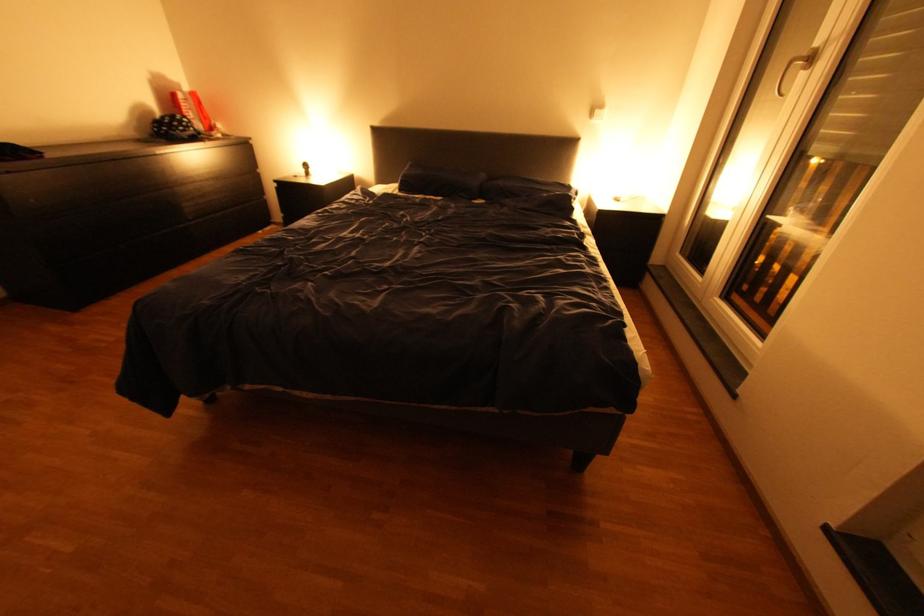
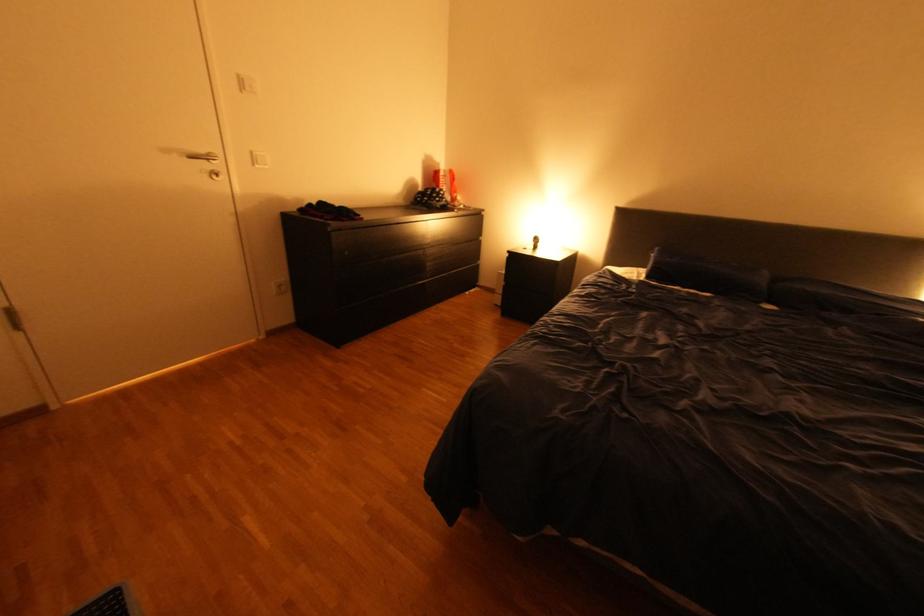
Locate, in the second image, the point that corresponds to (404,190) in the first image.

(648, 277)